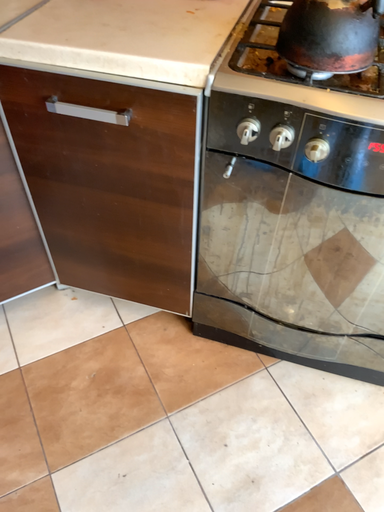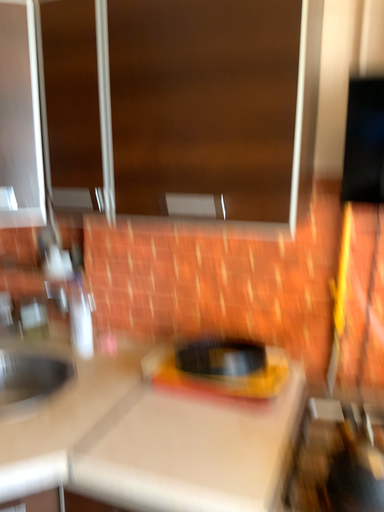
Question: How did the camera likely rotate when shooting the video?

Choices:
 (A) rotated upward
 (B) rotated downward

Answer: (A)